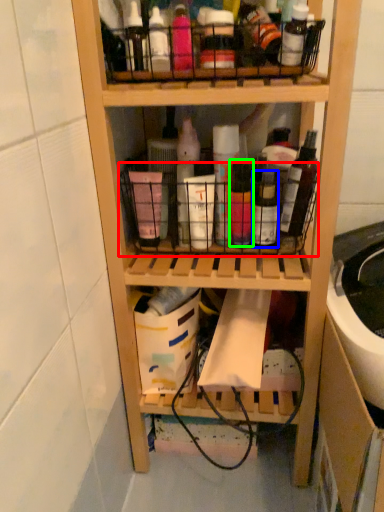
Question: Considering the real-world distances, which object is closest to basket (highlighted by a red box)? bottle (highlighted by a blue box) or bottle (highlighted by a green box).

Choices:
 (A) bottle
 (B) bottle

Answer: (B)